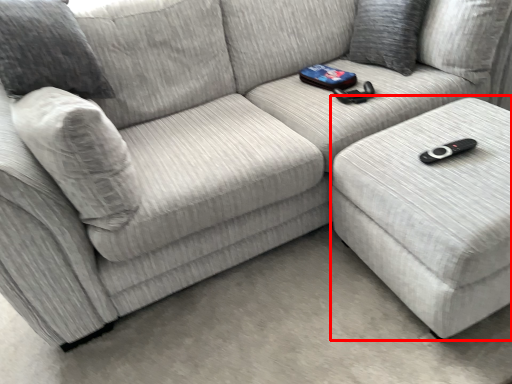
Question: From the image's perspective, where is table (annotated by the red box) located relative to pillow?

Choices:
 (A) above
 (B) below

Answer: (B)